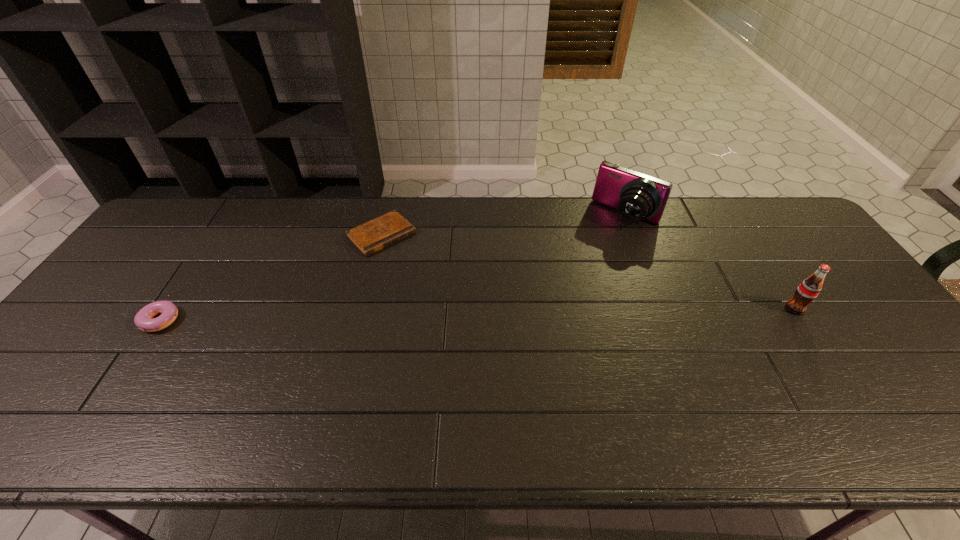
Identify the location of free spot located 0.220m on the spine side of the diary. This screenshot has width=960, height=540. (443, 293).

Where is `free space located 0.110m on the front-facing side of the second object from right to left`? The width and height of the screenshot is (960, 540). free space located 0.110m on the front-facing side of the second object from right to left is located at coordinates (599, 251).

Locate an element on the screen. This screenshot has height=540, width=960. free space located 0.140m on the front-facing side of the second object from right to left is located at coordinates (594, 256).

Locate an element on the screen. This screenshot has width=960, height=540. blank space located 0.150m on the front-facing side of the second object from right to left is located at coordinates (593, 258).

The image size is (960, 540). What are the coordinates of `diary that is at the far edge` in the screenshot? It's located at (370, 237).

Find the location of a particular element. The height and width of the screenshot is (540, 960). camera positioned at the far edge is located at coordinates (637, 196).

Where is `object located in the left edge section of the desktop`? object located in the left edge section of the desktop is located at coordinates (143, 320).

I want to click on vacant point at the far edge, so click(x=267, y=223).

Where is `vacant area at the near edge of the desktop`? The width and height of the screenshot is (960, 540). vacant area at the near edge of the desktop is located at coordinates (596, 392).

Image resolution: width=960 pixels, height=540 pixels. What are the coordinates of `free region at the left edge of the desktop` in the screenshot? It's located at (143, 248).